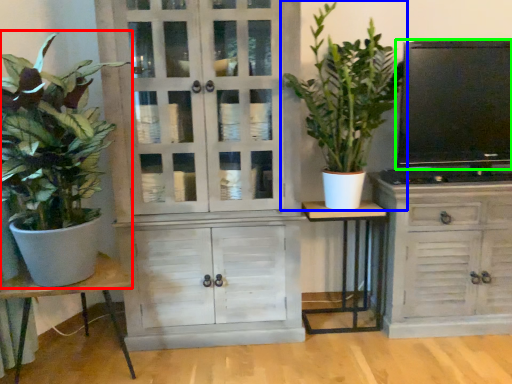
Question: Estimate the real-world distances between objects in this image. Which object is farther from houseplant (highlighted by a red box), houseplant (highlighted by a blue box) or television (highlighted by a green box)?

Choices:
 (A) houseplant
 (B) television

Answer: (B)